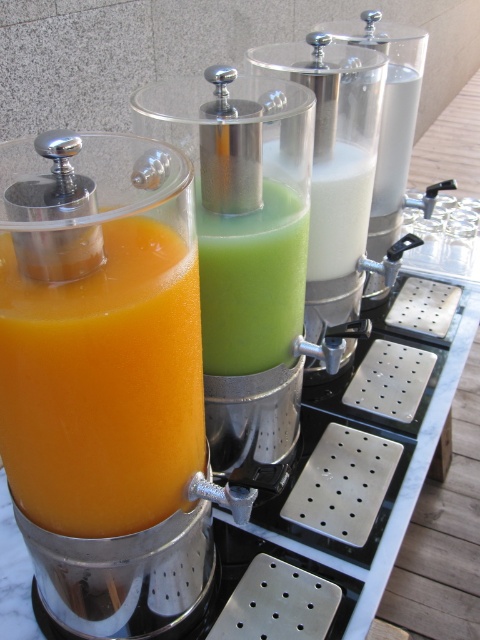
You are standing in front of a row of juice dispensers. There is a point marked at coordinates [252,282]. Which juice is this point located on?

The point is on the green matte juice at center.

You are a juice bar attendant and need to place a 40 cm wide promotional sign between the matte orange juice at left and the white matte milkshake at center. Can you fit it there?

The distance between the matte orange juice at left and the white matte milkshake at center is 42.90 centimeters, so yes, the 40 cm wide promotional sign can fit between them since it is narrower than the available space.